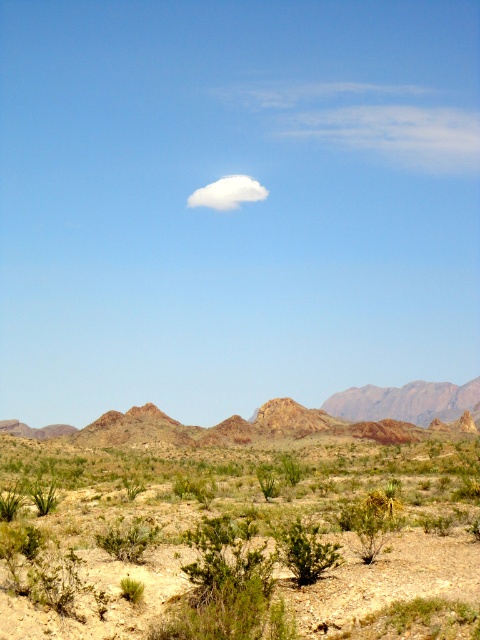
You are a hiker standing at the point with coordinates (x=278, y=417) in the desert scene. What is the terrain like at your current location?

The terrain at point (x=278, y=417) is a rustic rock formation at center.

You are an explorer in the desert and want to take a photo of the rustic rock formation at center and the white fluffy cloud at upper center. Which object will appear larger in your camera viewfinder?

The rustic rock formation at center will appear larger in the camera viewfinder because it is much taller than the white fluffy cloud at upper center.

You are a hiker standing at the base of the desert landscape. You see the green shrubs at center and the rustic rock formation at center. Which object is farther from you?

The green shrubs at center is 58.59 meters away from the rustic rock formation at center, so the rustic rock formation at center is farther away from you.